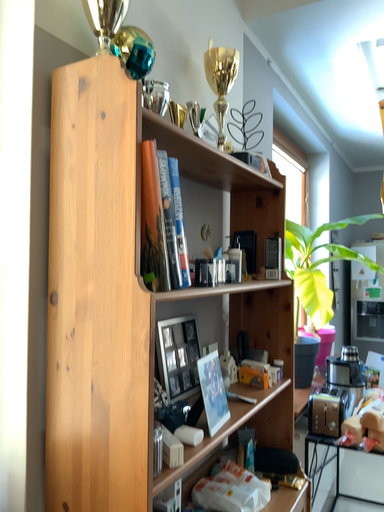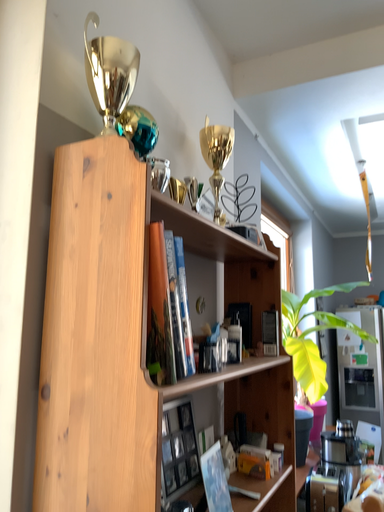
Question: Which way did the camera rotate in the video?

Choices:
 (A) rotated upward
 (B) rotated downward

Answer: (A)